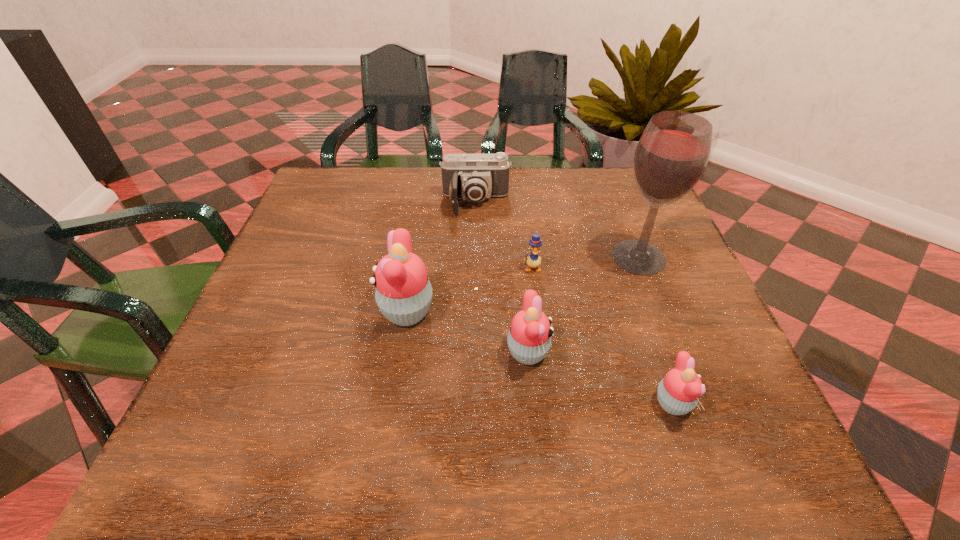
Find the location of a particular element. This screenshot has height=540, width=960. the leftmost cupcake is located at coordinates (403, 293).

At what (x,y) coordinates should I click in order to perform the action: click on the tallest cupcake. Please return your answer as a coordinate pair (x, y). Looking at the image, I should click on (403, 293).

At what (x,y) coordinates should I click in order to perform the action: click on the second cupcake from left to right. Please return your answer as a coordinate pair (x, y). Looking at the image, I should click on (529, 339).

Locate an element on the screen. the rightmost cupcake is located at coordinates (678, 393).

Identify the location of the tallest object. The height and width of the screenshot is (540, 960). (671, 156).

You are a GUI agent. You are given a task and a screenshot of the screen. Output one action in this format:
    pyautogui.click(x=<x>, y=<y>)
    Task: Click on the farthest object
    
    Given the screenshot: What is the action you would take?
    pyautogui.click(x=474, y=177)

Where is `duckling`? duckling is located at coordinates (533, 261).

You are a GUI agent. You are given a task and a screenshot of the screen. Output one action in this format:
    pyautogui.click(x=<x>, y=<y>)
    Task: Click on the free space located on the face of the second tallest object
    The width and height of the screenshot is (960, 540).
    Given the screenshot: What is the action you would take?
    pyautogui.click(x=280, y=310)

You are a GUI agent. You are given a task and a screenshot of the screen. Output one action in this format:
    pyautogui.click(x=<x>, y=<y>)
    Task: Click on the free space located on the face of the second tallest object
    The height and width of the screenshot is (540, 960).
    Given the screenshot: What is the action you would take?
    pyautogui.click(x=271, y=310)

This screenshot has height=540, width=960. I want to click on vacant area situated on the face of the second tallest object, so [x=255, y=310].